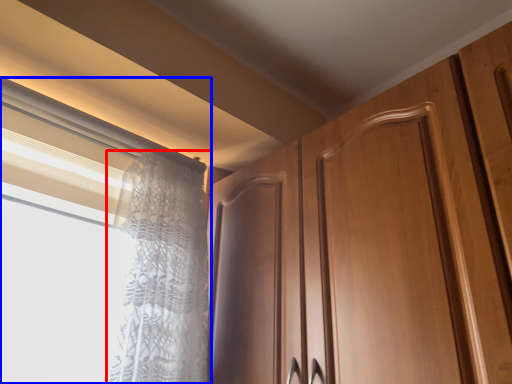
Question: Which of the following is the closest to the observer, curtain (highlighted by a red box) or window (highlighted by a blue box)?

Choices:
 (A) curtain
 (B) window

Answer: (B)